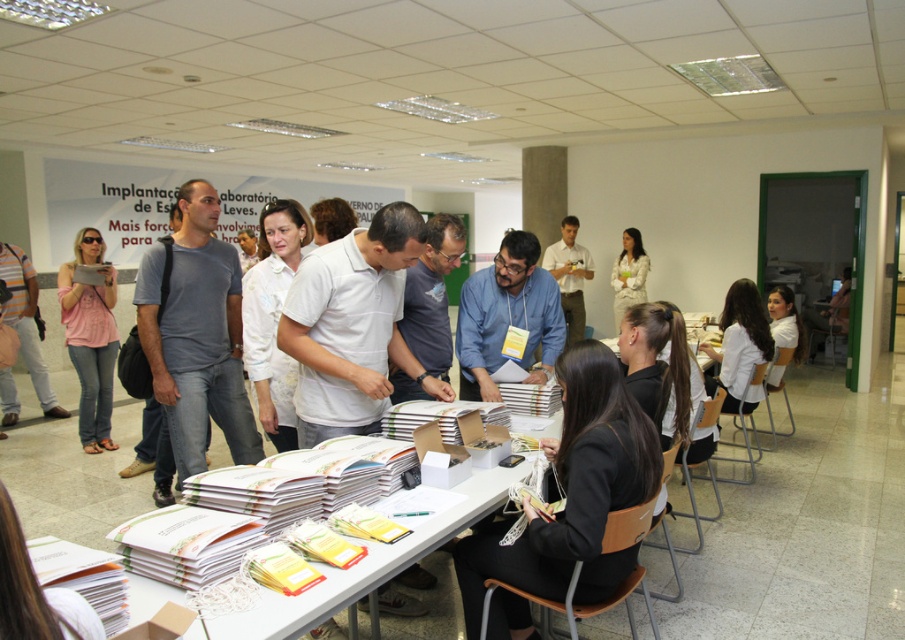
You are a photographer standing in the conference room. You want to take a photo of the black fabric jacket at lower right without including any people in the frame. Is the jacket far enough away from you to allow you to zoom in and focus on it exclusively?

The black fabric jacket at lower right is 1.84 meters away from camera, so yes, the photographer can zoom in and focus on the jacket without including people in the frame since it is sufficiently distant.

You are organizing a meeting and need to place a name tag on the table so it doesn t get covered by the shirt. Based on the scene, which object is wider, the white paper at center or the matte white shirt at center?

The white paper at center might be wider than matte white shirt at center, so placing the name tag on the white paper at center would be less likely to be covered by the matte white shirt at center.